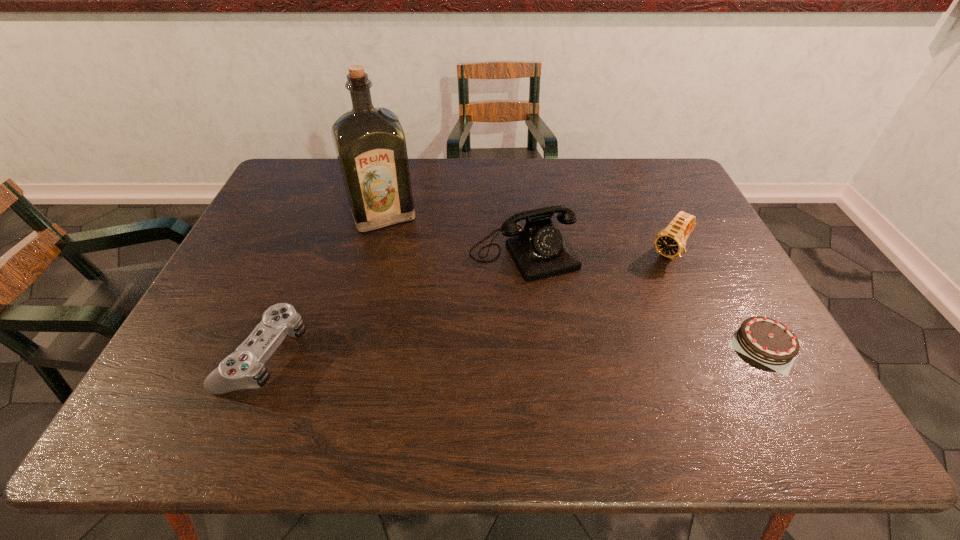
At what (x,y) coordinates should I click in order to perform the action: click on vacant region that satisfies the following two spatial constraints: 1. on the back side of the control; 2. on the right side of the telephone. Please return your answer as a coordinate pair (x, y). Image resolution: width=960 pixels, height=540 pixels. Looking at the image, I should click on (306, 254).

Identify the location of vacant space that satisfies the following two spatial constraints: 1. on the back side of the control; 2. on the right side of the telephone. This screenshot has width=960, height=540. (306, 254).

Where is `vacant space that satisfies the following two spatial constraints: 1. on the back side of the control; 2. on the left side of the chocolate cake`? The image size is (960, 540). vacant space that satisfies the following two spatial constraints: 1. on the back side of the control; 2. on the left side of the chocolate cake is located at coordinates (270, 343).

Image resolution: width=960 pixels, height=540 pixels. In order to click on free space that satisfies the following two spatial constraints: 1. on the back side of the control; 2. on the right side of the shortest object in this screenshot , I will do `click(270, 343)`.